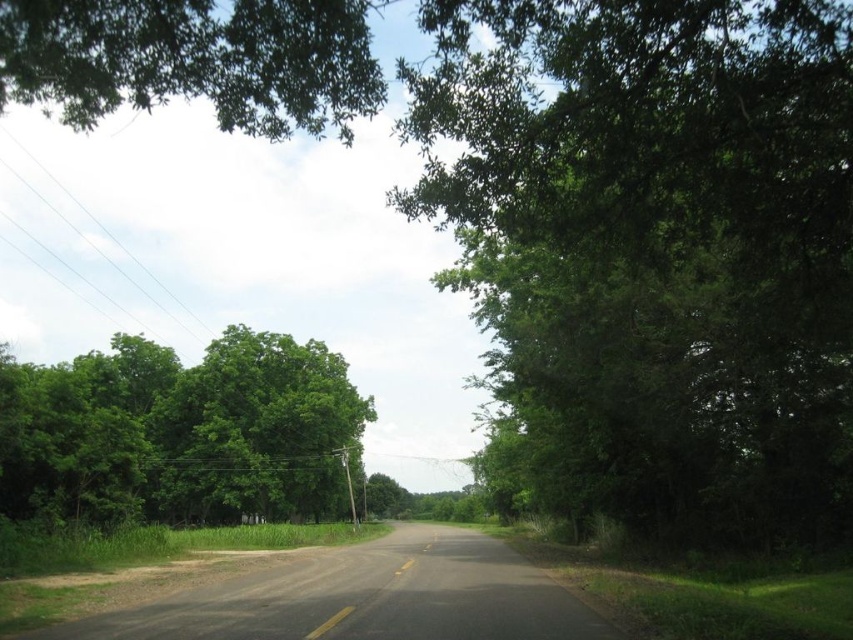
You are driving along the rural road and want to know which tree is nearer to you. Can you tell me whether the green leafy tree at center or the green leafy tree at left is closer to your current position?

The green leafy tree at center is closer to the viewer than the green leafy tree at left, so the green leafy tree at center is nearer to your current position.

You are a driver approaching the rural road scene. You need to park your car on the side of the road where the green leafy tree at center is located. Which side of the road should you choose?

The green leafy tree at center is located at the center of the road, so you should park on either side as it is centrally positioned.